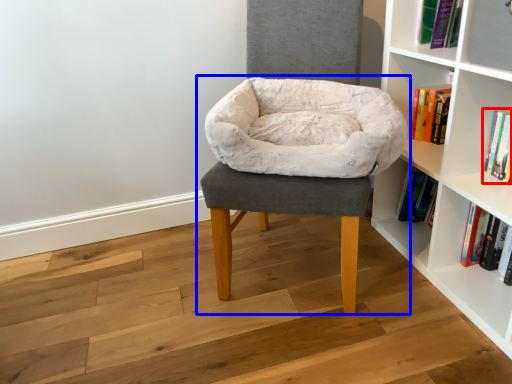
Question: Which point is closer to the camera, book (highlighted by a red box) or chair (highlighted by a blue box)?

Choices:
 (A) book
 (B) chair

Answer: (B)